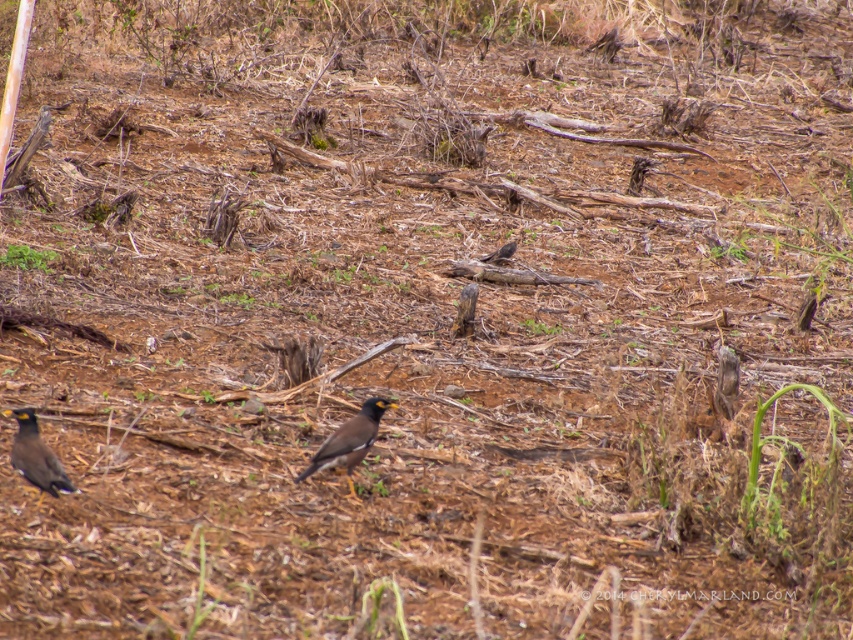
Question: Is brown speckled feathers at center positioned at the back of brown matte bird at center?

Choices:
 (A) yes
 (B) no

Answer: (B)

Question: Which of the following is the closest to the observer?

Choices:
 (A) (334, 435)
 (B) (480, 257)
 (C) (16, 448)

Answer: (C)

Question: Considering the real-world distances, which object is farthest from the brown matte bird at center?

Choices:
 (A) brown speckled feathers at center
 (B) shiny black bird at center

Answer: (B)

Question: Can you confirm if shiny black bird at center is wider than brown matte bird at center?

Choices:
 (A) yes
 (B) no

Answer: (A)

Question: Is shiny black bird at center bigger than brown matte bird at center?

Choices:
 (A) yes
 (B) no

Answer: (A)

Question: Which object is positioned closest to the brown speckled feathers at center?

Choices:
 (A) shiny black bird at center
 (B) brown matte bird at center

Answer: (A)